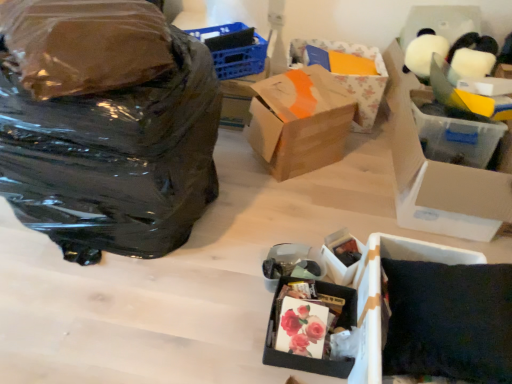
This screenshot has width=512, height=384. I want to click on free area in between brown cardboard box at center, placed as the 4th box when sorted from bottom to top, and matte black box at lower center, which is counted as the second box, starting from the bottom, so click(x=323, y=196).